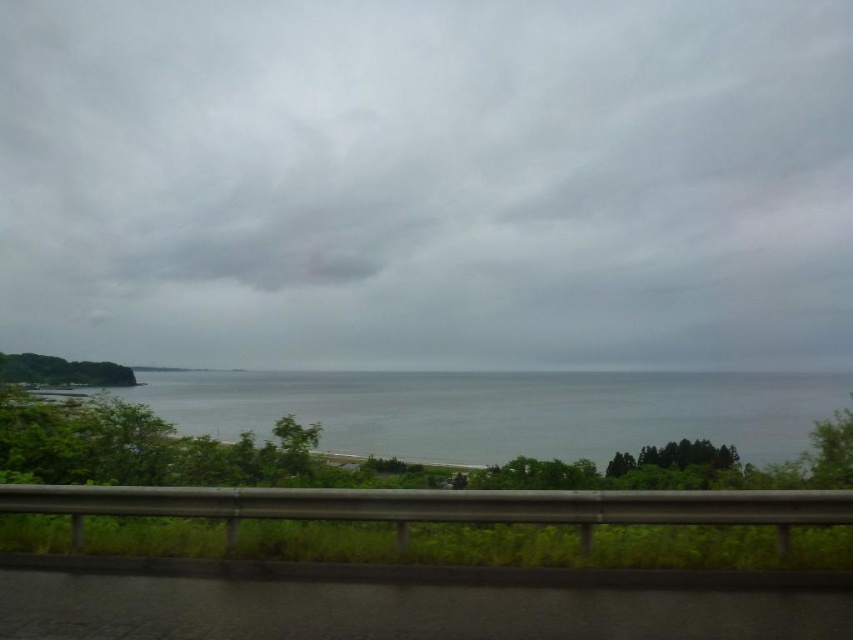
Is gray cloudy sky at upper center smaller than gray water at center?

Actually, gray cloudy sky at upper center might be larger than gray water at center.

Can you confirm if gray cloudy sky at upper center is positioned below gray water at center?

Incorrect, gray cloudy sky at upper center is not positioned below gray water at center.

Which is behind, point (724, 148) or point (363, 371)?

The point (724, 148) is behind.

Image resolution: width=853 pixels, height=640 pixels. Find the location of `gray cloudy sky at upper center`. gray cloudy sky at upper center is located at coordinates (428, 182).